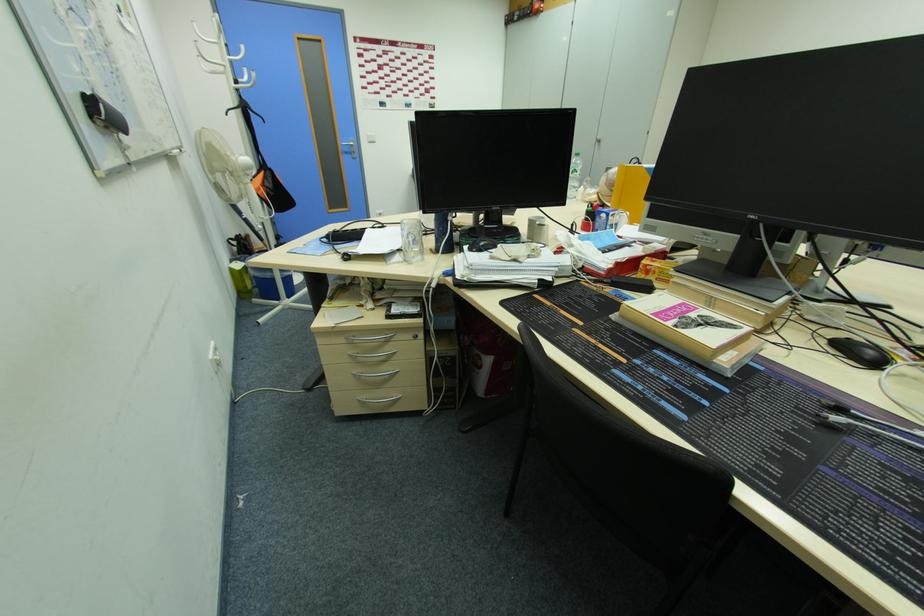
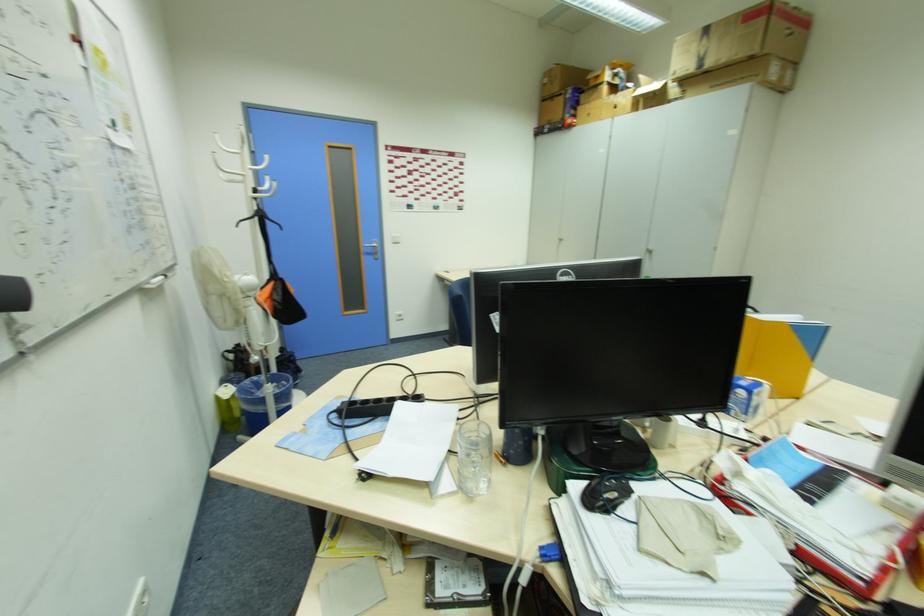
Locate, in the second image, the point that corresponds to point 630,215 in the first image.

(772, 384)